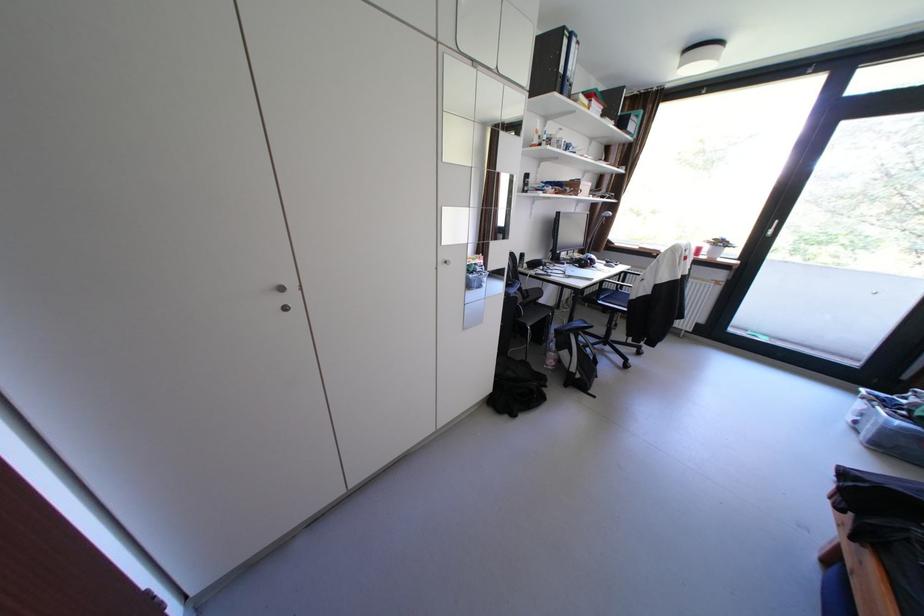
At what (x,y) coordinates should I click in order to perform the action: click on silver window handle. Please return your answer as a coordinate pair (x, y). Looking at the image, I should click on (772, 228).